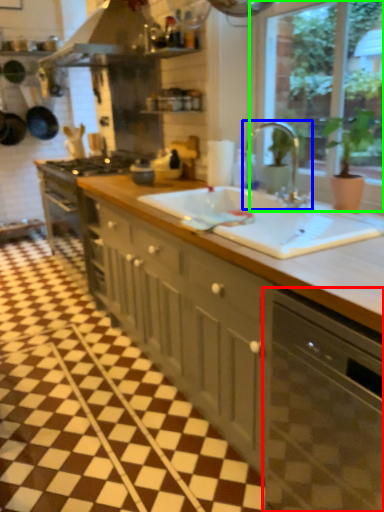
Question: Considering the real-world distances, which object is farthest from dish washer (highlighted by a red box)? tap (highlighted by a blue box) or window (highlighted by a green box)?

Choices:
 (A) tap
 (B) window

Answer: (B)